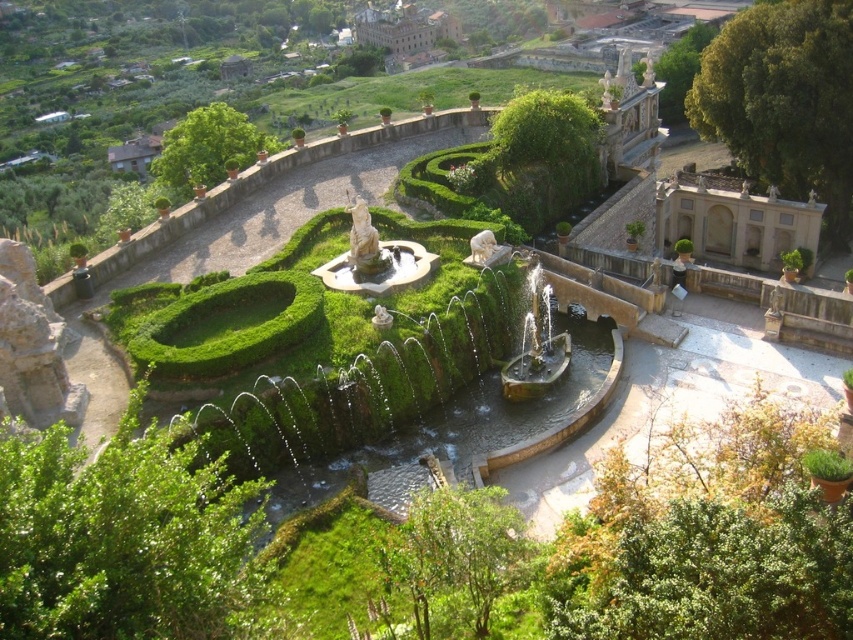
In order to click on green leafy bush at lower center in this screenshot , I will do `click(456, 556)`.

Is point (410, 564) farther from camera compared to point (428, 40)?

No, (410, 564) is closer to viewer.

Identify the location of green leafy bush at lower center. This screenshot has height=640, width=853. (456, 556).

Between green leafy bush at lower center and white marble statue at center, which one is positioned higher?

white marble statue at center

Is green leafy bush at lower center positioned in front of white marble statue at center?

Yes, it is.

Which is behind, point (461, 557) or point (422, 253)?

Point (422, 253)

The image size is (853, 640). In order to click on green leafy bush at lower center in this screenshot , I will do `click(456, 556)`.

Based on the photo, is green leafy bush at upper left bigger than brown stone palace at upper center?

No.

Describe the element at coordinates (207, 147) in the screenshot. The width and height of the screenshot is (853, 640). I see `green leafy bush at upper left` at that location.

Does point (209, 129) come behind point (358, 40)?

No, (209, 129) is closer to viewer.

The width and height of the screenshot is (853, 640). I want to click on green leafy bush at upper left, so click(207, 147).